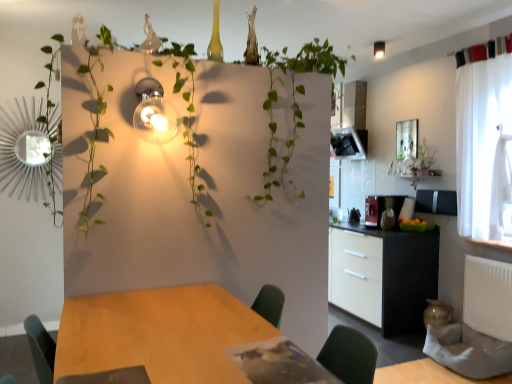
Locate an element on the screen. Image resolution: width=512 pixels, height=384 pixels. vacant space underneath metallic bulb at upper left, acting as the 1th light fixture starting from the front (from a real-world perspective) is located at coordinates (158, 294).